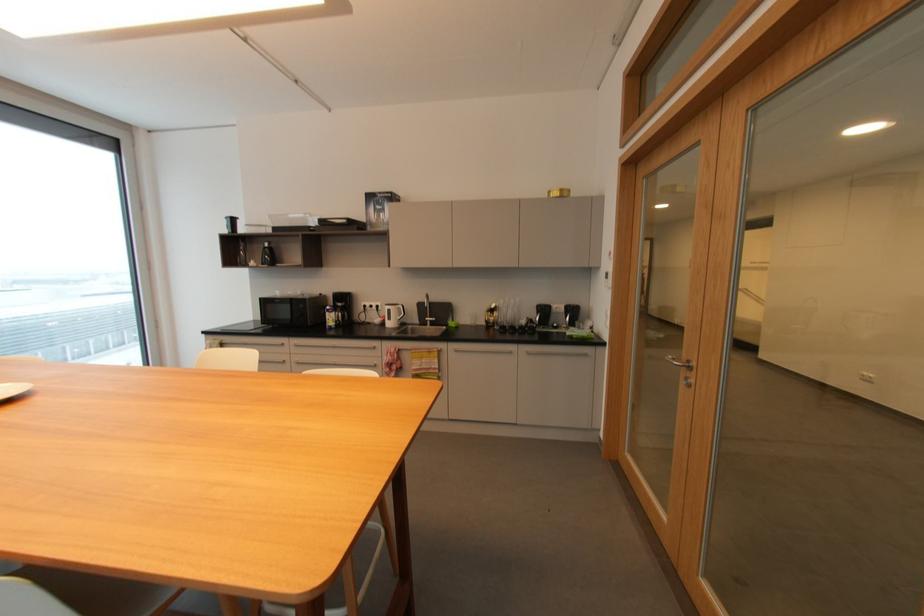
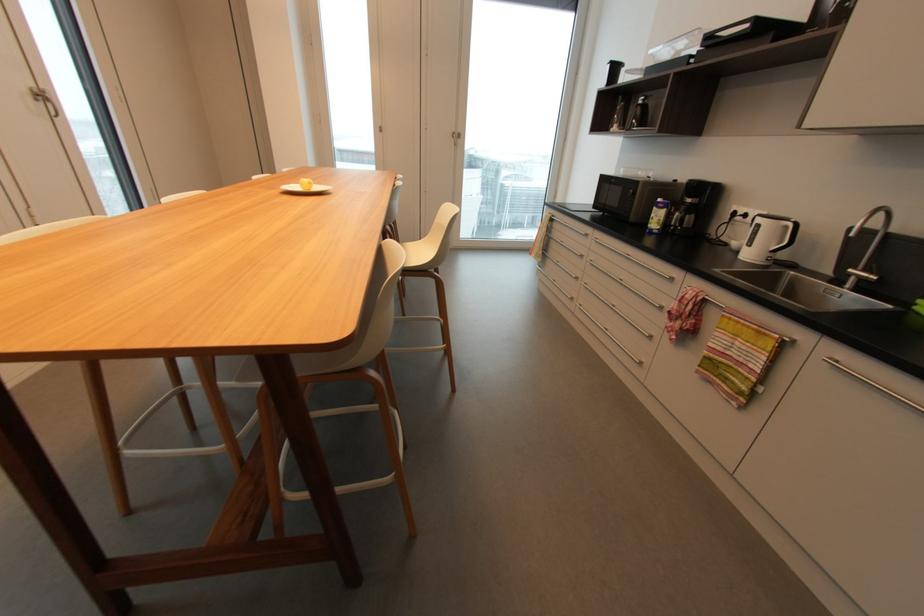
Find the pixel in the second image that matches (430,318) in the first image.

(854, 270)